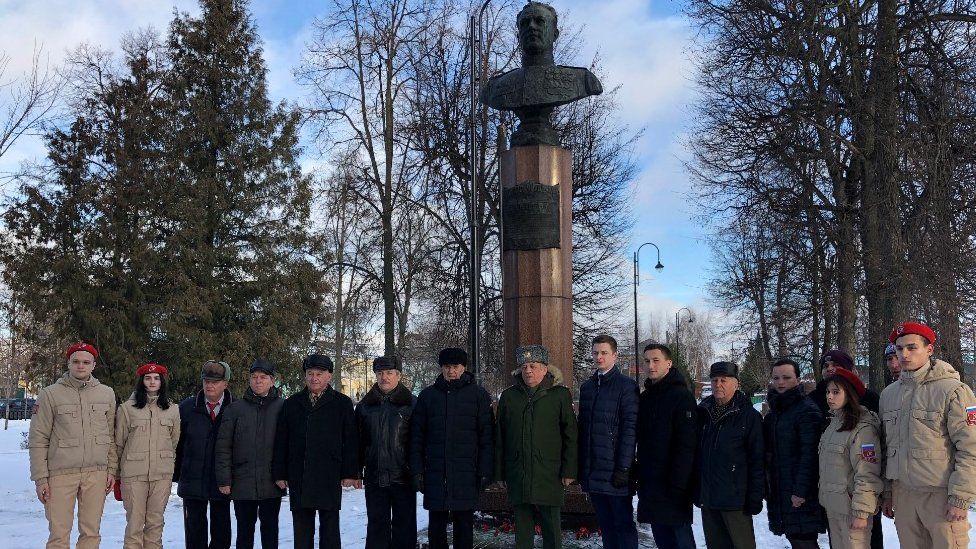
Locate an element on the screen. the left eye of bust is located at coordinates (539, 21).